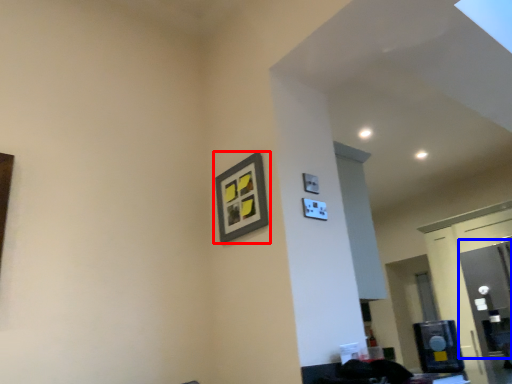
Question: Among these objects, which one is farthest to the camera, picture frame (highlighted by a red box) or glass door (highlighted by a blue box)?

Choices:
 (A) picture frame
 (B) glass door

Answer: (B)